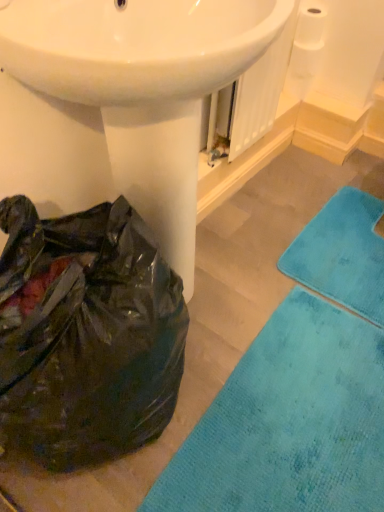
Locate an element on the screen. vacant space underneath teal soft rug at lower right (from a real-world perspective) is located at coordinates pyautogui.click(x=288, y=428).